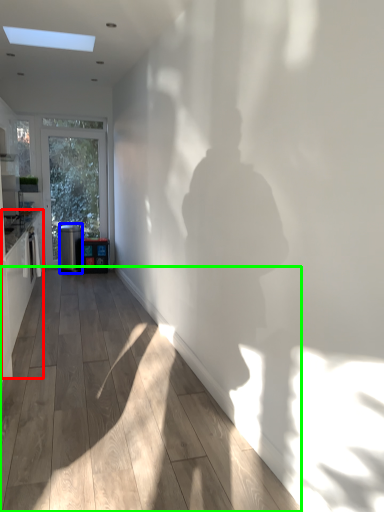
Question: Considering the real-world distances, which object is closest to cabinetry (highlighted by a red box)? appliance (highlighted by a blue box) or corridor (highlighted by a green box).

Choices:
 (A) appliance
 (B) corridor

Answer: (B)